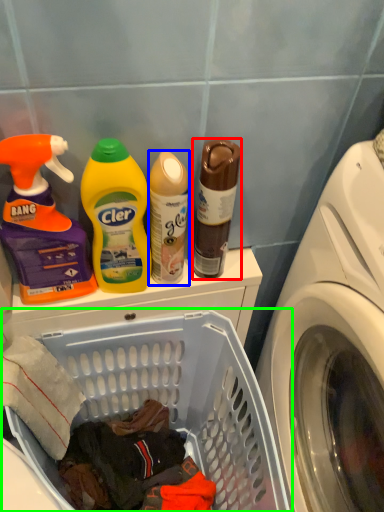
Question: Which object is positioned farthest from bottle (highlighted by a red box)? Select from cleaning product (highlighted by a blue box) and laundry basket (highlighted by a green box).

Choices:
 (A) cleaning product
 (B) laundry basket

Answer: (B)